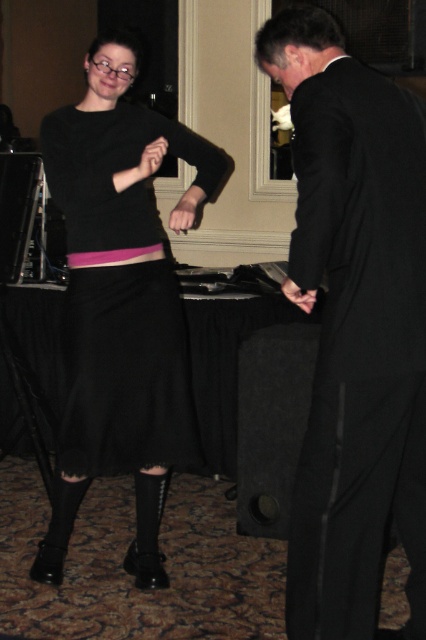
Can you confirm if black matte suit at right is bigger than pink fabric belt at center?

Indeed, black matte suit at right has a larger size compared to pink fabric belt at center.

Between black matte suit at right and pink fabric belt at center, which one appears on the left side from the viewer's perspective?

pink fabric belt at center is more to the left.

Identify the location of black matte suit at right. (354, 326).

Can you confirm if black matte suit at right is thinner than matte black skirt at center?

Yes.

Based on the photo, is black matte suit at right in front of matte black skirt at center?

Yes.

The image size is (426, 640). Find the location of `black matte suit at right`. black matte suit at right is located at coordinates (354, 326).

Who is more distant from viewer, [135,333] or [132,256]?

Positioned behind is point [132,256].

Find the location of a particular element. matte black skirt at center is located at coordinates (121, 403).